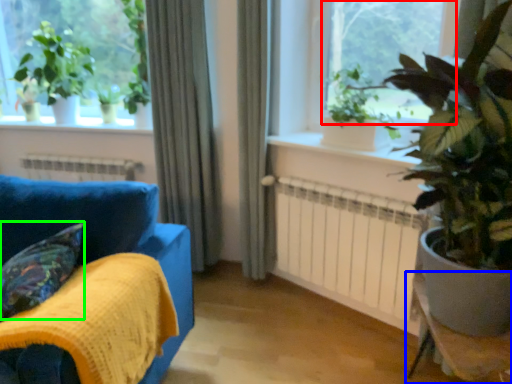
Question: Which object is positioned closest to window screen (highlighted by a red box)? Select from table (highlighted by a blue box) and pillow (highlighted by a green box).

Choices:
 (A) table
 (B) pillow

Answer: (A)